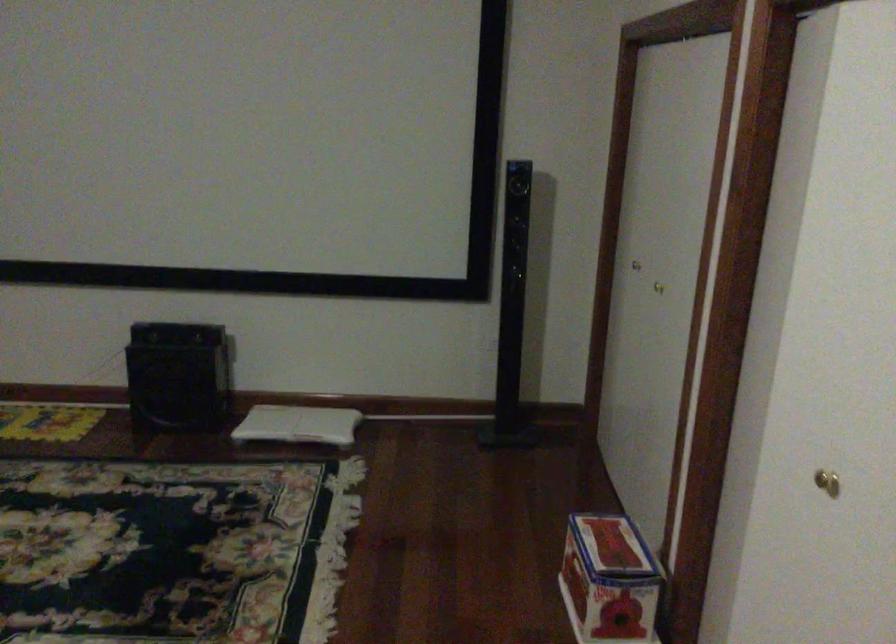
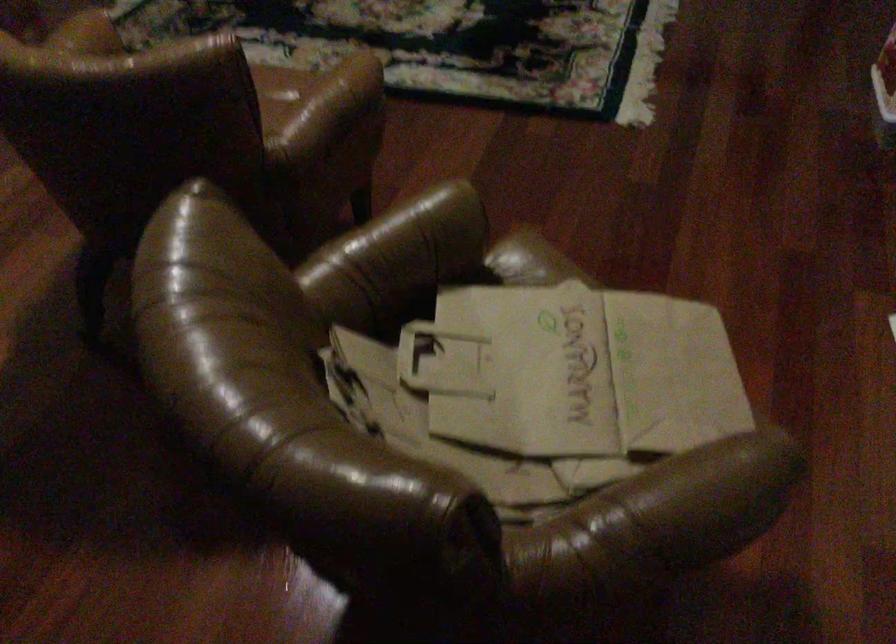
The first image is from the beginning of the video and the second image is from the end. How did the camera likely rotate when shooting the video?

The camera rotated toward left-down.